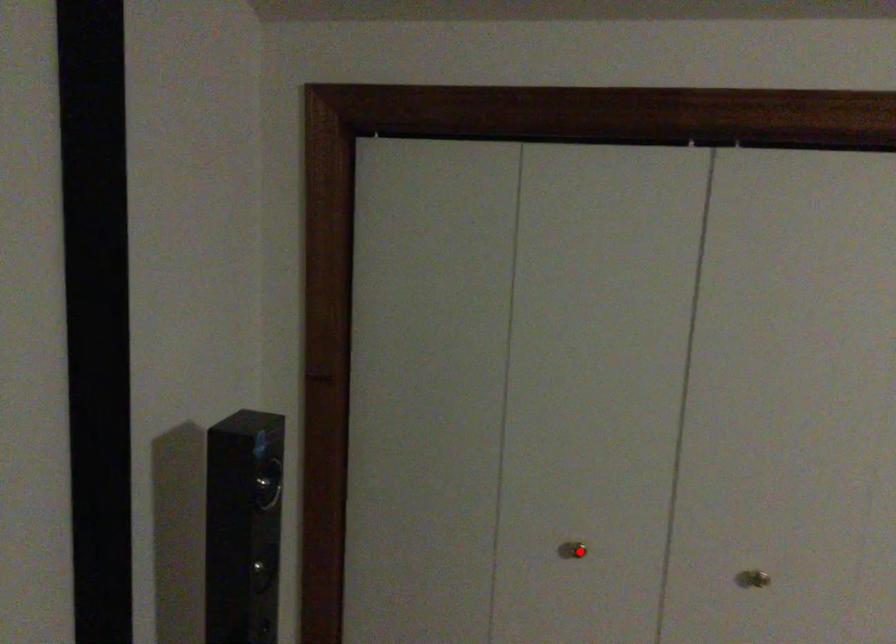
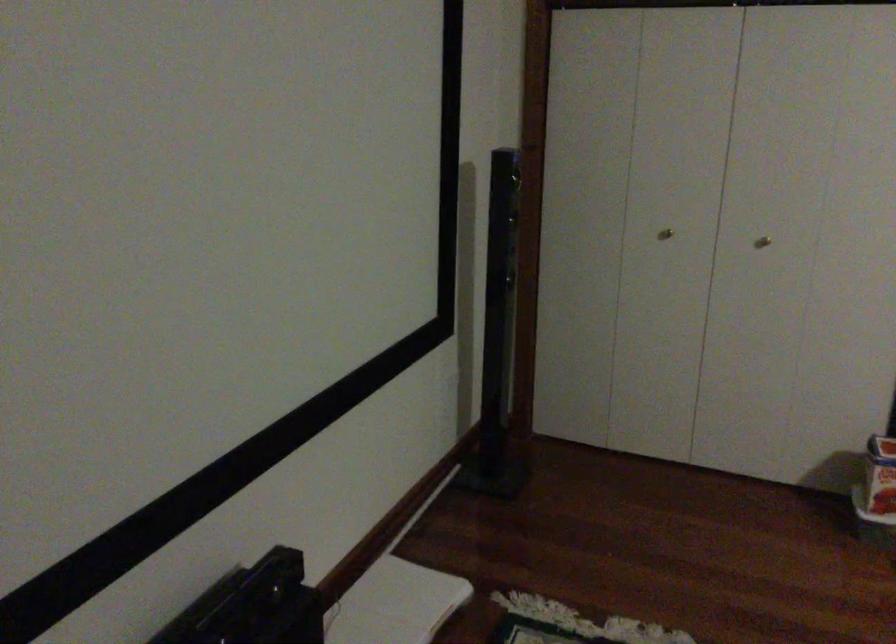
Question: I am providing you with two images of the same scene from different viewpoints. In image1, a red point is highlighted. Considering the same 3D point in image2, which of the following is correct?

Choices:
 (A) It is closer
 (B) It is farther

Answer: (B)